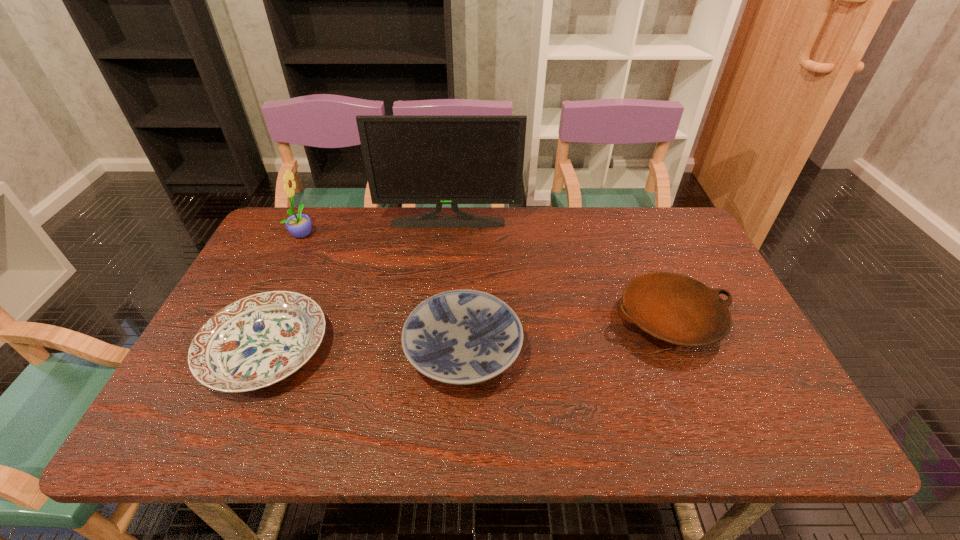
Where is `monitor`? monitor is located at coordinates (454, 160).

Identify the location of sunflower. This screenshot has width=960, height=540. (299, 225).

Identify the location of the second plate from right to left. The height and width of the screenshot is (540, 960). (460, 337).

You are a GUI agent. You are given a task and a screenshot of the screen. Output one action in this format:
    pyautogui.click(x=<x>, y=<y>)
    Task: Click on the rightmost object
    
    Given the screenshot: What is the action you would take?
    pyautogui.click(x=674, y=308)

Locate an element on the screen. Image resolution: width=960 pixels, height=540 pixels. the shortest plate is located at coordinates (259, 340).

Identify the location of the leftmost plate. (259, 340).

Identify the location of vacant space situated on the front-facing side of the tallest object. (440, 310).

The width and height of the screenshot is (960, 540). Find the location of `vacant area situated 0.200m on the front-facing side of the sunflower`. vacant area situated 0.200m on the front-facing side of the sunflower is located at coordinates (377, 233).

Find the location of a particular element. This screenshot has height=540, width=960. vacant area located 0.170m on the right of the second plate from right to left is located at coordinates tap(592, 351).

This screenshot has height=540, width=960. I want to click on vacant region located on the back of the rightmost plate, so click(x=637, y=242).